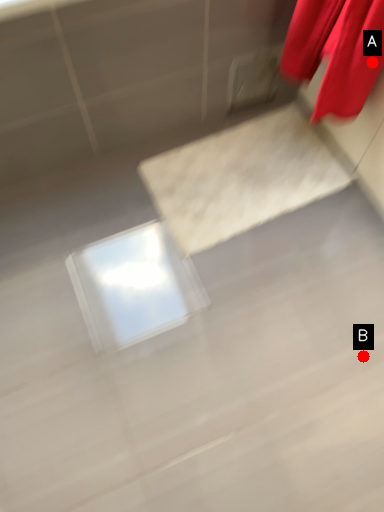
Question: Two points are circled on the image, labeled by A and B beside each circle. Which point is further to the camera?

Choices:
 (A) A is further
 (B) B is further

Answer: (B)